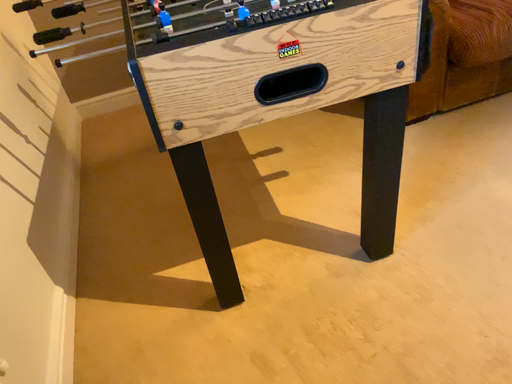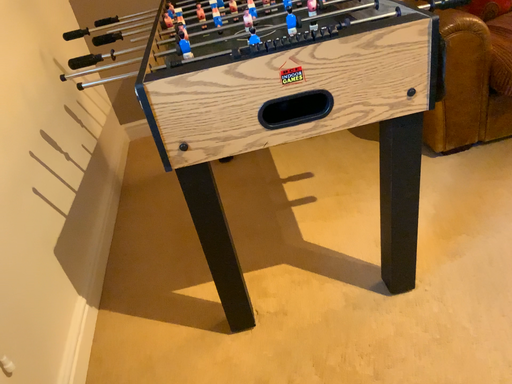
Question: Which way did the camera rotate in the video?

Choices:
 (A) rotated left
 (B) rotated right

Answer: (A)